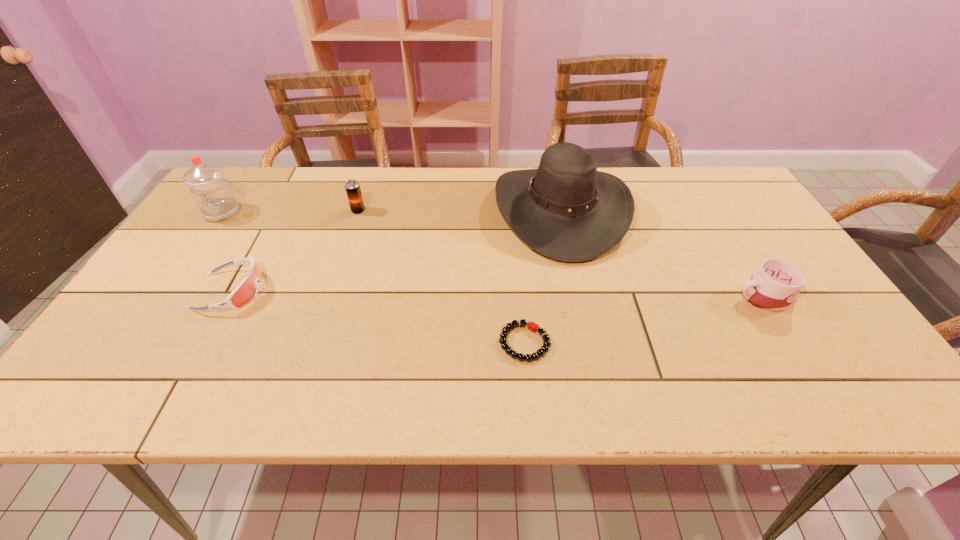
The image size is (960, 540). In order to click on the leftmost object in this screenshot , I will do (x=213, y=196).

Find the location of a particular element. The height and width of the screenshot is (540, 960). cowboy hat is located at coordinates (566, 210).

In order to click on the fourth object from right to left in this screenshot , I will do `click(352, 187)`.

Find the location of `beer can`. beer can is located at coordinates (352, 187).

This screenshot has height=540, width=960. In order to click on the rightmost object in this screenshot , I will do `click(774, 287)`.

Identify the location of the fourth tallest object. The width and height of the screenshot is (960, 540). (774, 287).

At what (x,y) coordinates should I click in order to perform the action: click on goggles. Please return your answer as a coordinate pair (x, y). This screenshot has width=960, height=540. Looking at the image, I should click on (246, 291).

At what (x,y) coordinates should I click in order to perform the action: click on the second shortest object. Please return your answer as a coordinate pair (x, y). Looking at the image, I should click on (246, 291).

Where is `the nearest object`? The width and height of the screenshot is (960, 540). the nearest object is located at coordinates (532, 326).

Where is `the shortest object`? Image resolution: width=960 pixels, height=540 pixels. the shortest object is located at coordinates (532, 326).